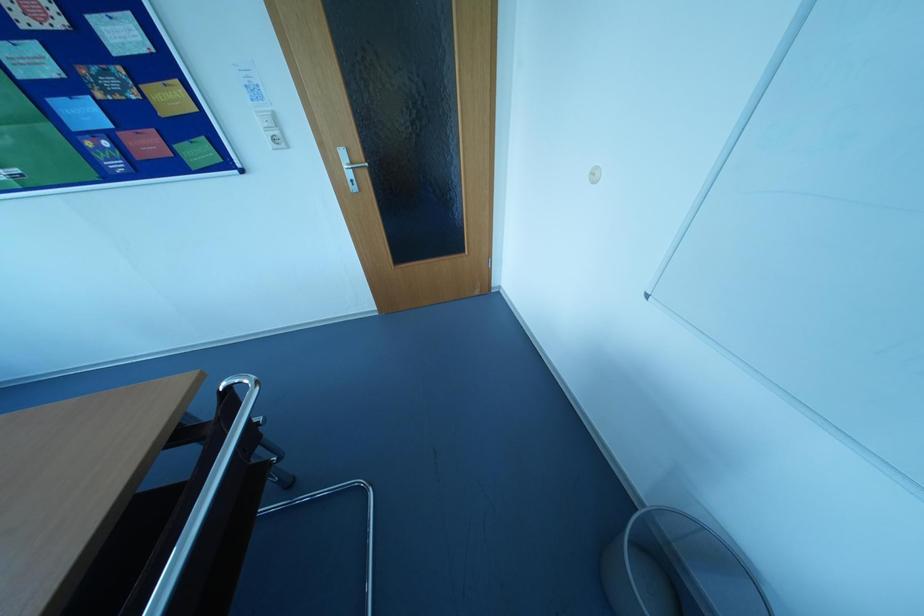
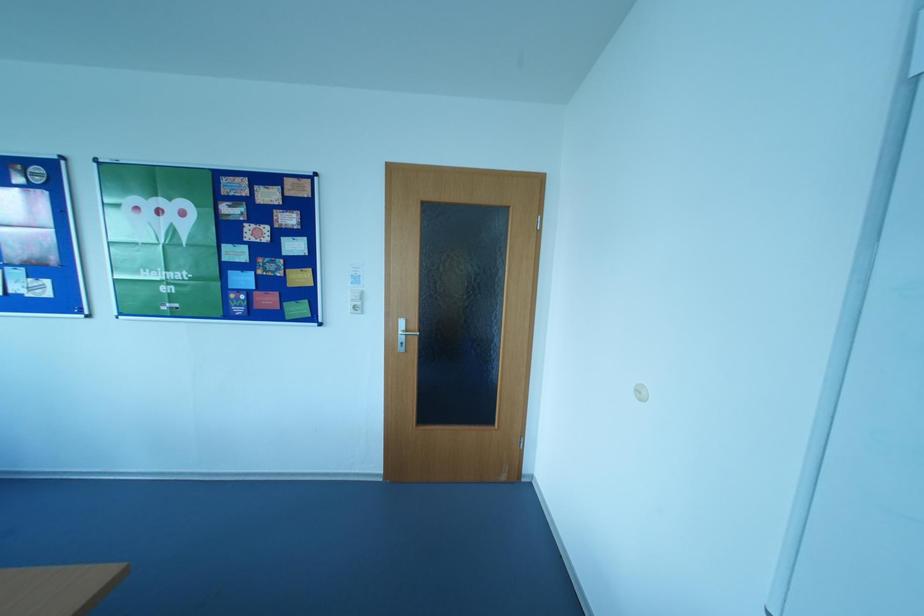
Question: The images are taken continuously from a first-person perspective. In which direction is your viewpoint rotating?

Choices:
 (A) Left
 (B) Right
 (C) Up
 (D) Down

Answer: (C)